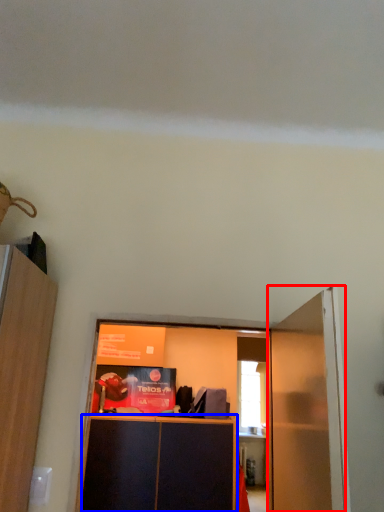
Question: Which of the following is the farthest to the observer, door (highlighted by a red box) or cabinetry (highlighted by a blue box)?

Choices:
 (A) door
 (B) cabinetry

Answer: (B)